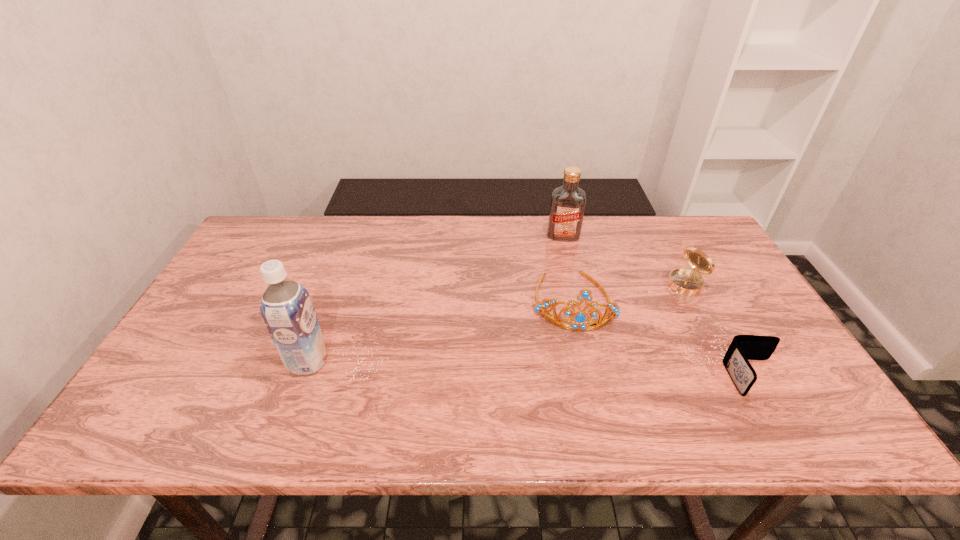
Where is `free space between the compass and the soya milk`? The width and height of the screenshot is (960, 540). free space between the compass and the soya milk is located at coordinates (496, 322).

You are a GUI agent. You are given a task and a screenshot of the screen. Output one action in this format:
    pyautogui.click(x=<x>, y=<y>)
    Task: Click on the unoccupied position between the fourth tallest object and the wallet
    
    Given the screenshot: What is the action you would take?
    pyautogui.click(x=719, y=330)

Select which object appears as the third closest to the farthest object. Please provide its 2D coordinates. Your answer should be formatted as a tuple, i.e. [(x, y)], where the tuple contains the x and y coordinates of a point satisfying the conditions above.

[(743, 347)]

You are a GUI agent. You are given a task and a screenshot of the screen. Output one action in this format:
    pyautogui.click(x=<x>, y=<y>)
    Task: Click on the closest object to the third shortest object
    This screenshot has width=960, height=540.
    Given the screenshot: What is the action you would take?
    pyautogui.click(x=567, y=207)